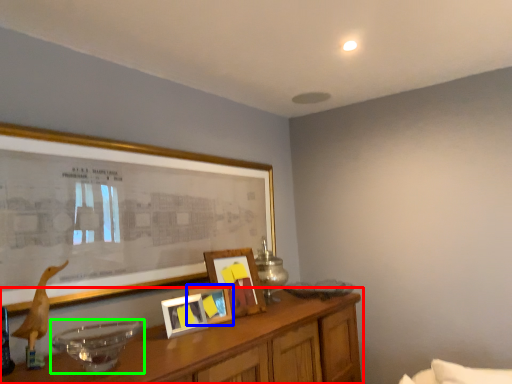
Question: Which is nearer to the table (highlighted by a red box)? picture frame (highlighted by a blue box) or glass bowl (highlighted by a green box).

Choices:
 (A) picture frame
 (B) glass bowl

Answer: (A)